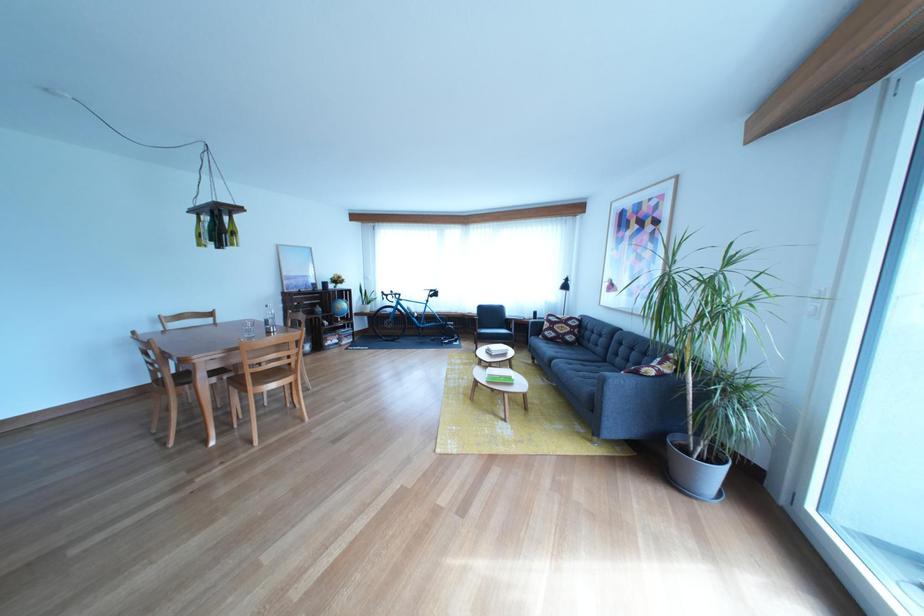
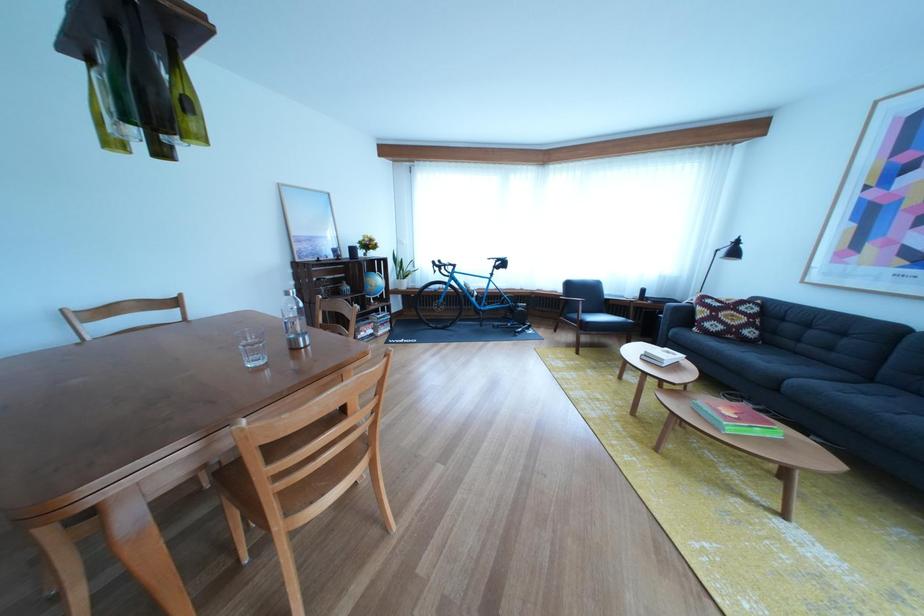
Where in the second image is the point corresponding to point (362, 297) from the first image?

(398, 265)